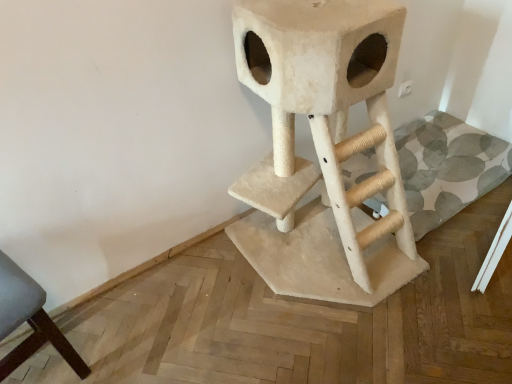
Locate an element on the screen. Image resolution: width=512 pixels, height=384 pixels. vacant region below beige carpeted cat tree at center (from a real-world perspective) is located at coordinates (309, 257).